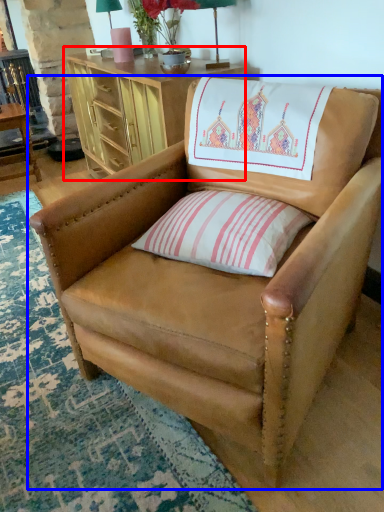
Question: Which point is closer to the camera, desk (highlighted by a red box) or chair (highlighted by a blue box)?

Choices:
 (A) desk
 (B) chair

Answer: (B)